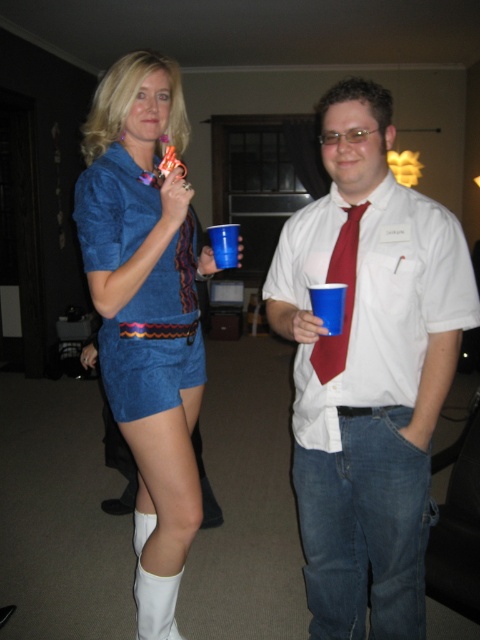
Is point (327, 500) more distant than point (339, 236)?

Yes.

Which is more to the left, white cotton shirt at center or matte red tie at center?

matte red tie at center

Describe the element at coordinates (368, 369) in the screenshot. This screenshot has height=640, width=480. I see `white cotton shirt at center` at that location.

Where is `white cotton shirt at center`? white cotton shirt at center is located at coordinates (368, 369).

Can you confirm if matte blue dress at center is thinner than matte red tie at center?

In fact, matte blue dress at center might be wider than matte red tie at center.

Between point (104, 378) and point (367, 202), which one is positioned behind?

Positioned behind is point (104, 378).

Does point (165, 349) lie behind point (324, 380)?

Yes.

Where is `matte blue dress at center`? Image resolution: width=480 pixels, height=640 pixels. matte blue dress at center is located at coordinates [146, 310].

Can you confirm if white cotton shirt at center is positioned to the right of matte blue dress at center?

Correct, you'll find white cotton shirt at center to the right of matte blue dress at center.

Who is positioned more to the left, white cotton shirt at center or matte blue dress at center?

matte blue dress at center is more to the left.

Between point (320, 616) and point (128, 228), which one is positioned in front?

Point (128, 228)

I want to click on white cotton shirt at center, so click(x=368, y=369).